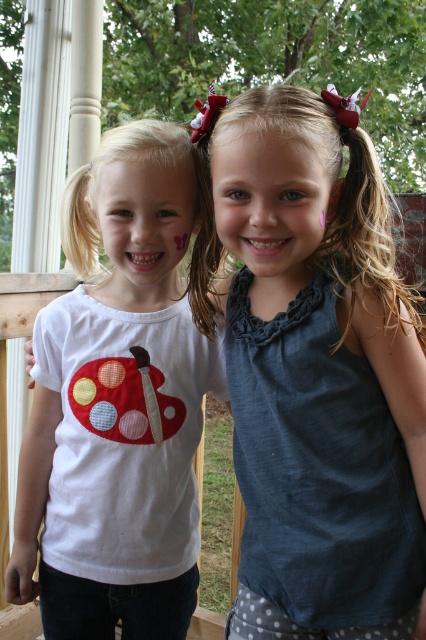
You are a photographer trying to capture a clear shot of the blue fabric shirt at center and the white matte shirt with ladybug design at left. Which shirt should you focus on first to ensure it appears sharp in the photo?

The blue fabric shirt at center should be focused on first because it is in front of the white matte shirt with ladybug design at left, making it closer to the camera.

You are a photographer trying to focus on the blue fabric shirt at center and the white matte shirt with ladybug design at left. Which shirt should you adjust your camera to focus on first if you want to capture both shirts clearly in the same photo?

The blue fabric shirt at center is above the white matte shirt with ladybug design at left, so you should focus on the blue fabric shirt at center first to ensure both shirts are in focus.

You are a photographer trying to capture a photo of both points mentioned. You need to adjust your camera so that both points are visible in the frame. Given that point A is at point (368, 243) and point B is at point (32, 452), which point should you focus on first to ensure both are in the frame?

Point A at (368, 243) is in front of point B at (32, 452), so you should focus on point A first to ensure both are in the frame.